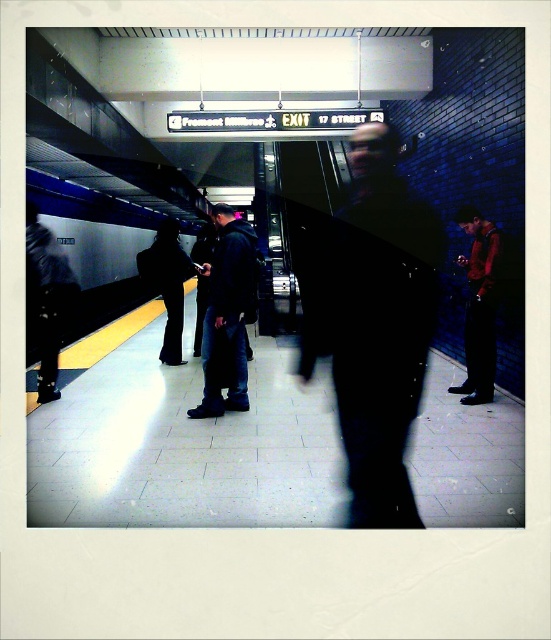
Which is more to the right, metallic silver platform at center or metallic silver train at left?

metallic silver platform at center

Locate an element on the screen. This screenshot has height=640, width=551. metallic silver platform at center is located at coordinates pos(197,401).

Which is in front, point (41, 500) or point (175, 252)?

Point (41, 500) is more forward.

Which is in front, point (446, 298) or point (169, 340)?

Point (446, 298) is in front.

Locate an element on the screen. This screenshot has height=640, width=551. metallic silver platform at center is located at coordinates (197, 401).

Between dark blue jeans at center and black fabric pants at center, which one has more height?

dark blue jeans at center is taller.

Image resolution: width=551 pixels, height=640 pixels. In order to click on dark blue jeans at center in this screenshot , I will do `click(226, 314)`.

Does point (249, 230) come behind point (141, 273)?

No, (249, 230) is closer to viewer.

Locate an element on the screen. dark blue jeans at center is located at coordinates (226, 314).